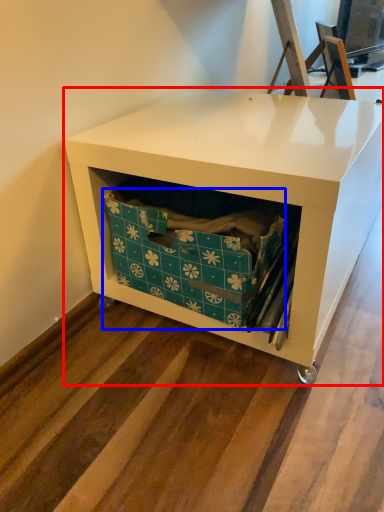
Question: Among these objects, which one is nearest to the camera, furniture (highlighted by a red box) or storage box (highlighted by a blue box)?

Choices:
 (A) furniture
 (B) storage box

Answer: (A)